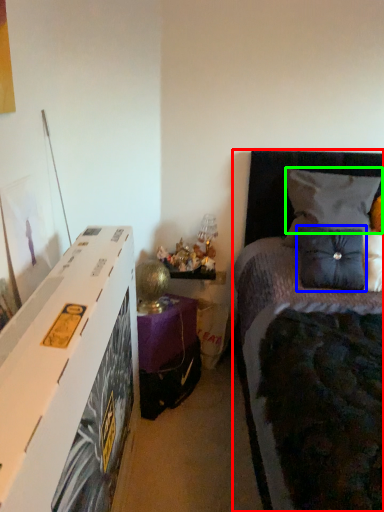
Question: Estimate the real-world distances between objects in this image. Which object is closer to bed (highlighted by a red box), pillow (highlighted by a blue box) or pillow (highlighted by a green box)?

Choices:
 (A) pillow
 (B) pillow

Answer: (B)